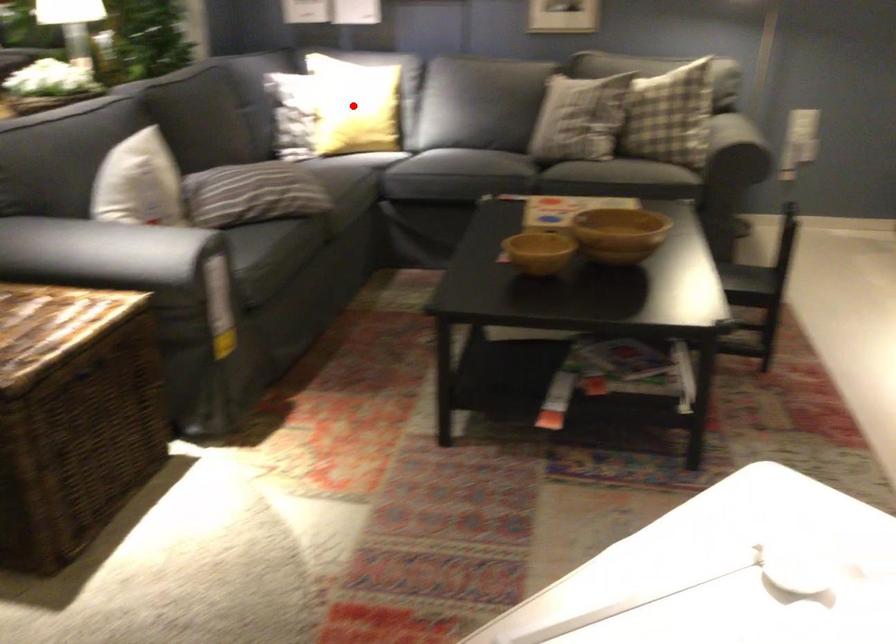
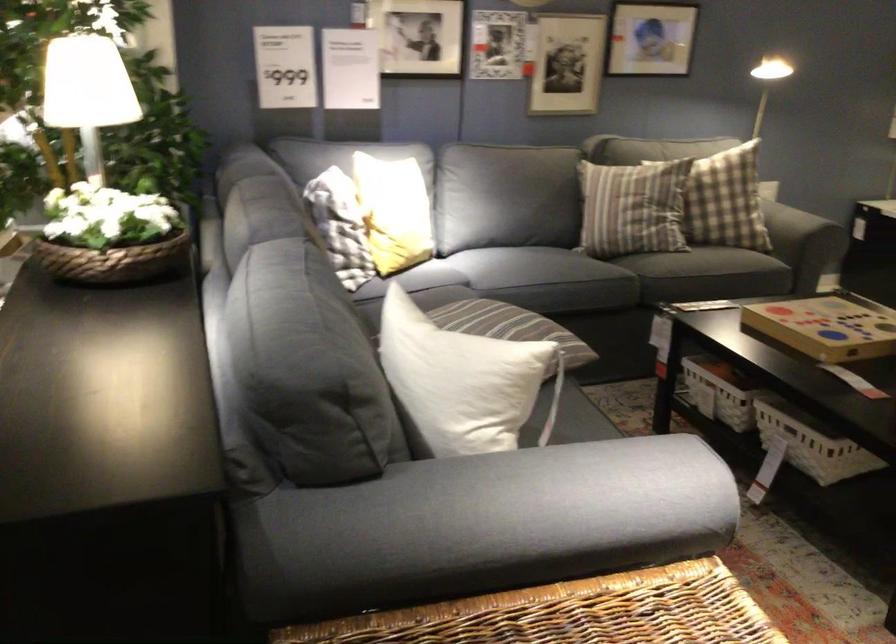
Question: I am providing you with two images of the same scene from different viewpoints. A red point is marked on the first image. Is the red point's position out of view in image 2?

Choices:
 (A) Yes
 (B) No

Answer: (A)